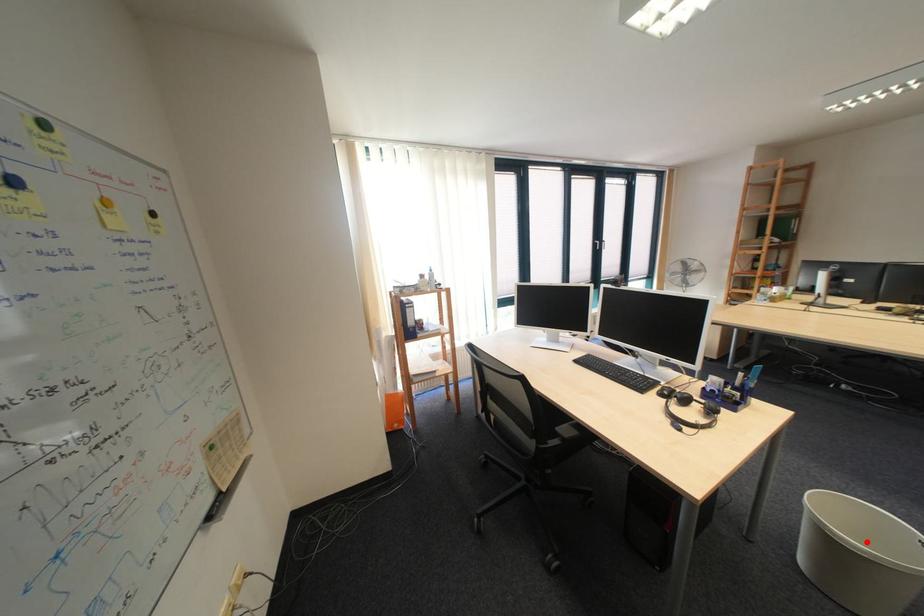
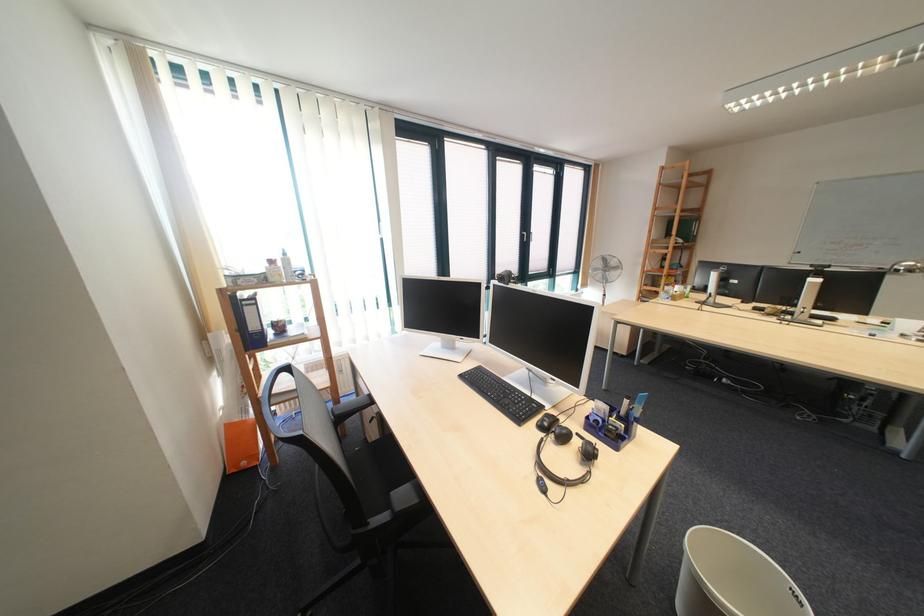
Locate, in the second image, the point that corresponds to the highlighted location in the first image.

(743, 605)